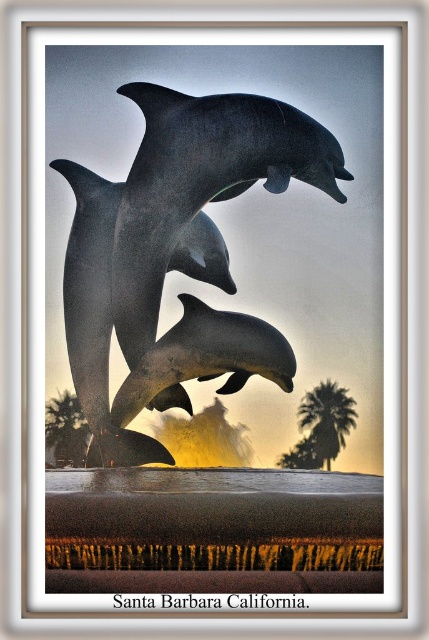
Question: Which point is closer to the camera?

Choices:
 (A) (72, 420)
 (B) (196, 337)
 (C) (332, 412)

Answer: (B)

Question: From the image, what is the correct spatial relationship of polished gray dolphins at center in relation to green leafy palm tree at lower left?

Choices:
 (A) below
 (B) above

Answer: (B)

Question: Is shiny silver dolphin at center thinner than green leafy palm tree at center right?

Choices:
 (A) yes
 (B) no

Answer: (B)

Question: Can you confirm if shiny metallic dolphins at center is wider than green leafy palm tree at center right?

Choices:
 (A) no
 (B) yes

Answer: (B)

Question: Which of these objects is positioned farthest from the green leafy palm tree at lower left?

Choices:
 (A) shiny metallic dolphins at center
 (B) green leafy palm tree at center right

Answer: (A)

Question: Which point is closer to the camera?

Choices:
 (A) (73, 376)
 (B) (289, 378)

Answer: (B)